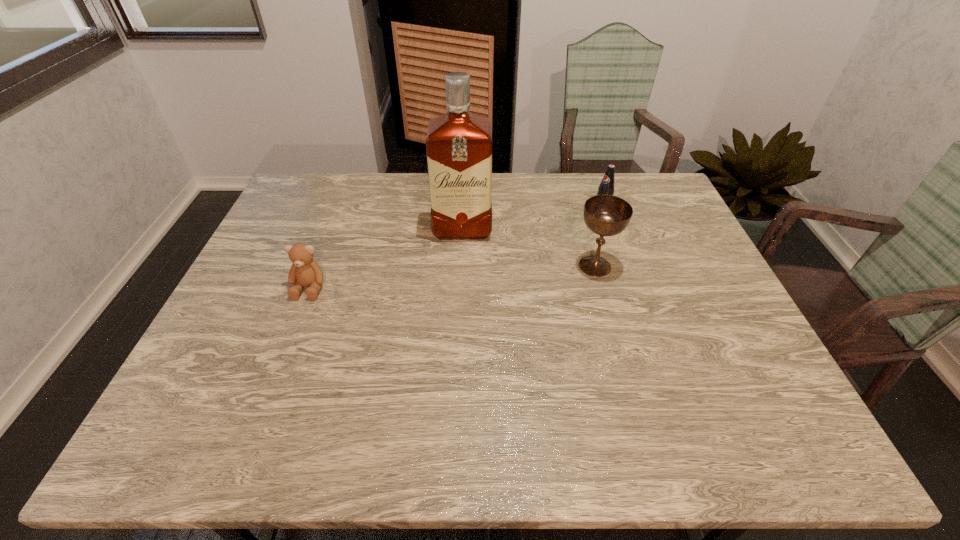
Find the location of a particular element. This screenshot has width=960, height=540. free space on the desktop that is between the leftmost object and the chalice and is positioned on the front label of the pop is located at coordinates (482, 274).

What are the coordinates of `vacant spot on the desktop that is between the shortest object and the chalice and is positioned on the front label of the third object from right to left` in the screenshot? It's located at point(462,276).